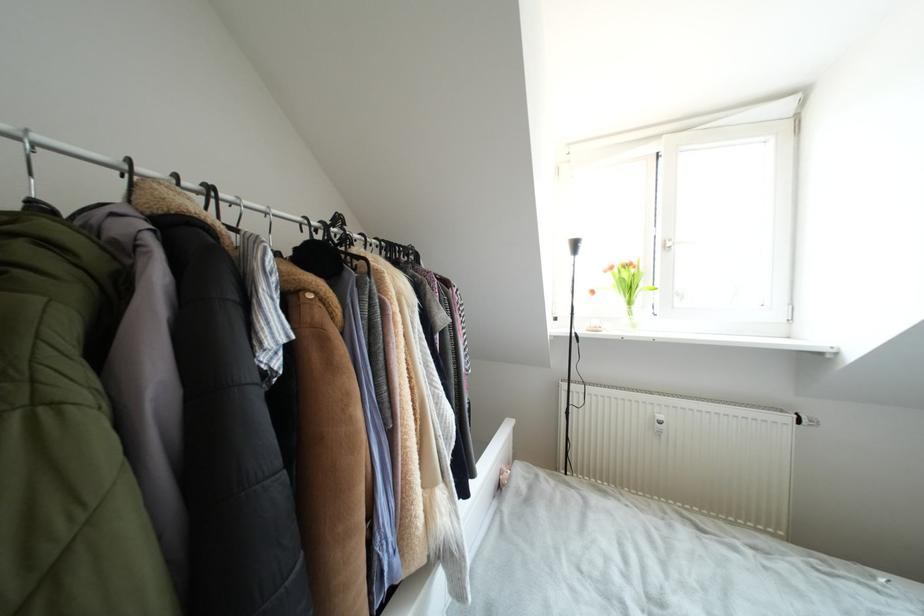
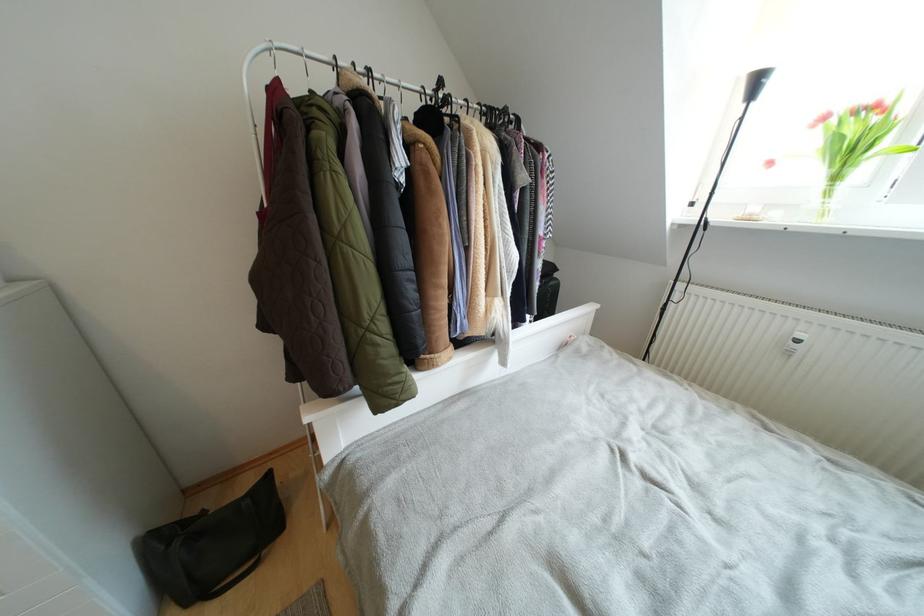
Locate, in the second image, the point that corresponds to [664,421] in the first image.

(805, 339)